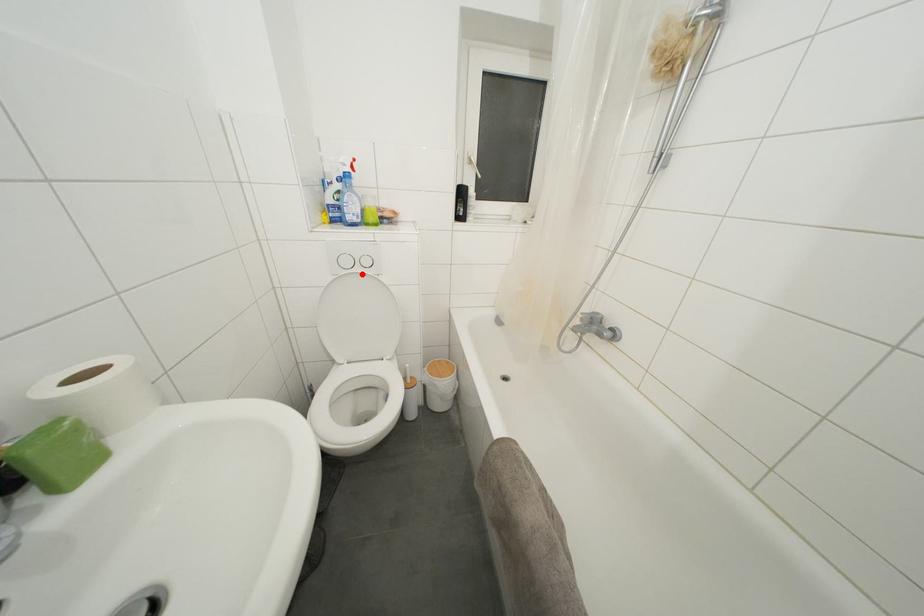
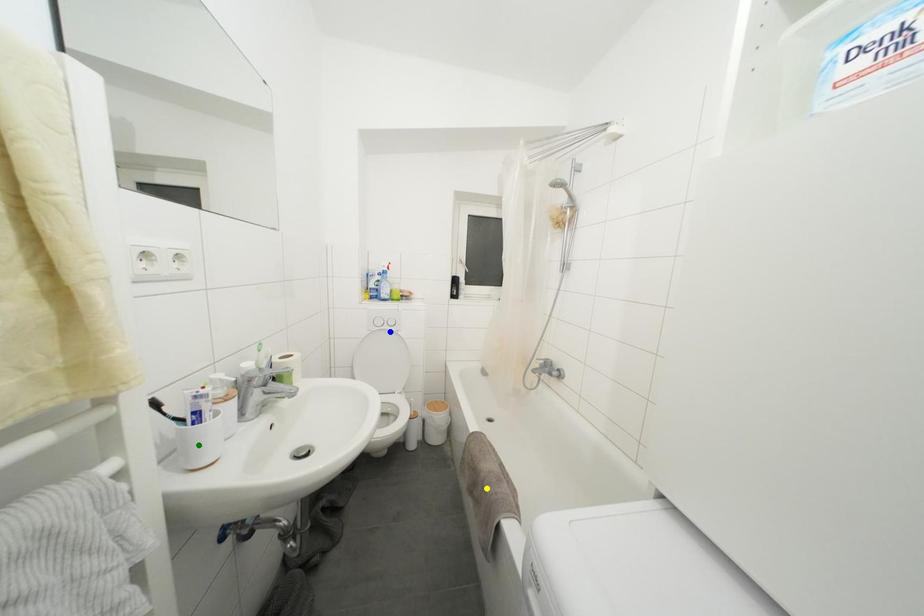
Question: I am providing you with two images of the same scene from different viewpoints. A red point is marked on the first image. You are given multiple points on the second image. Which point in image 2 represents the same 3d spot as the red point in image 1?

Choices:
 (A) blue point
 (B) green point
 (C) yellow point

Answer: (A)